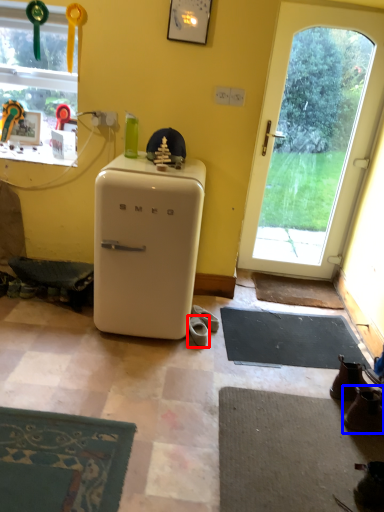
Question: Which point is closer to the camera, footwear (highlighted by a red box) or footwear (highlighted by a blue box)?

Choices:
 (A) footwear
 (B) footwear

Answer: (B)